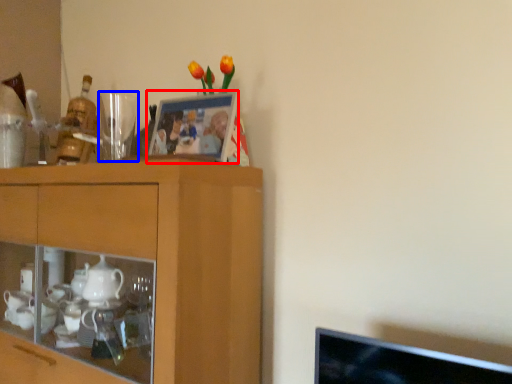
Question: Among these objects, which one is farthest to the camera, picture frame (highlighted by a red box) or tableware (highlighted by a blue box)?

Choices:
 (A) picture frame
 (B) tableware

Answer: (B)